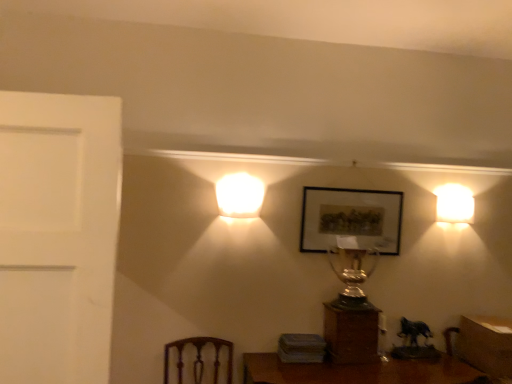
Question: Is matte black picture frame at center surrounding wooden trophy at center?

Choices:
 (A) no
 (B) yes

Answer: (A)

Question: Does matte black picture frame at center appear on the left side of wooden trophy at center?

Choices:
 (A) no
 (B) yes

Answer: (A)

Question: Is matte black picture frame at center in front of wooden trophy at center?

Choices:
 (A) yes
 (B) no

Answer: (B)

Question: Does matte black picture frame at center have a lesser height compared to wooden trophy at center?

Choices:
 (A) no
 (B) yes

Answer: (A)

Question: Is matte black picture frame at center thinner than wooden trophy at center?

Choices:
 (A) yes
 (B) no

Answer: (A)

Question: From a real-world perspective, is matte black picture frame at center positioned over wooden trophy at center based on gravity?

Choices:
 (A) no
 (B) yes

Answer: (B)

Question: Is wooden table at lower right located outside wooden trophy at center?

Choices:
 (A) no
 (B) yes

Answer: (B)

Question: Is wooden table at lower right smaller than wooden trophy at center?

Choices:
 (A) yes
 (B) no

Answer: (B)

Question: Is wooden table at lower right wider than wooden trophy at center?

Choices:
 (A) no
 (B) yes

Answer: (B)

Question: Is wooden table at lower right further to the viewer compared to wooden trophy at center?

Choices:
 (A) no
 (B) yes

Answer: (A)

Question: Is wooden table at lower right at the right side of wooden trophy at center?

Choices:
 (A) yes
 (B) no

Answer: (A)

Question: Does wooden table at lower right contain wooden trophy at center?

Choices:
 (A) yes
 (B) no

Answer: (B)

Question: Is white glossy wall sconce at right, the 1th lamp in the back-to-front sequence, to the left of matte black picture frame at center from the viewer's perspective?

Choices:
 (A) no
 (B) yes

Answer: (A)